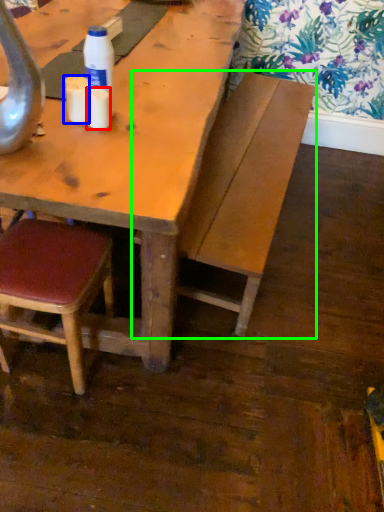
Question: Considering the real-world distances, which object is closest to coffee cup (highlighted by a red box)? coffee cup (highlighted by a blue box) or bench (highlighted by a green box).

Choices:
 (A) coffee cup
 (B) bench

Answer: (A)